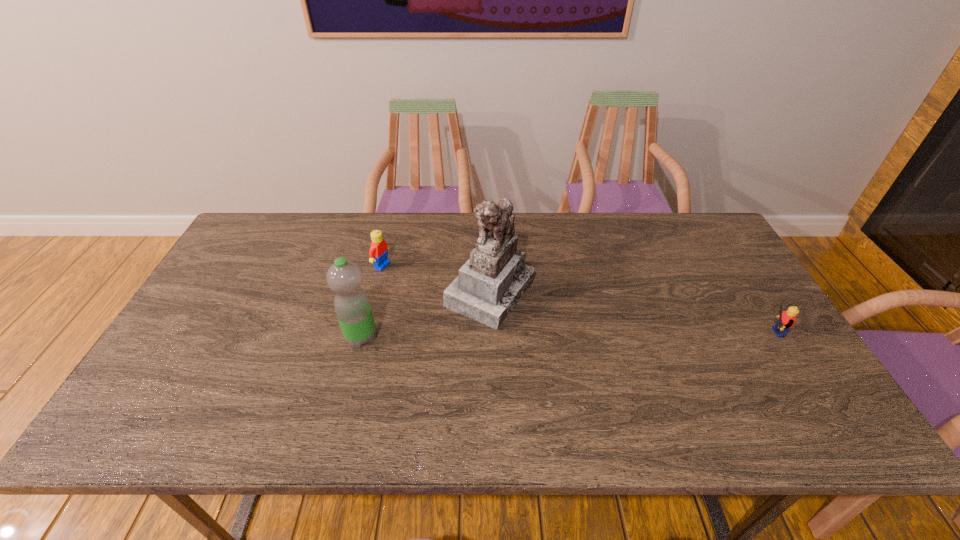
This screenshot has width=960, height=540. I want to click on water bottle, so click(x=352, y=306).

Find the location of a particular element. This screenshot has height=540, width=960. the nearer Lego is located at coordinates (786, 320).

This screenshot has height=540, width=960. Identify the location of the right Lego. (786, 320).

Find the location of a particular element. the second object from right to left is located at coordinates (489, 285).

Image resolution: width=960 pixels, height=540 pixels. Find the location of `figurine`. figurine is located at coordinates tap(489, 285).

Locate an element on the screen. The height and width of the screenshot is (540, 960). the left Lego is located at coordinates (378, 253).

Find the location of `free space located on the right of the third shortest object`. free space located on the right of the third shortest object is located at coordinates (446, 338).

This screenshot has height=540, width=960. I want to click on vacant space located 0.240m on the front-facing side of the rightmost object, so point(663,333).

Where is `vacant space situated on the front-facing side of the rightmost object`? The width and height of the screenshot is (960, 540). vacant space situated on the front-facing side of the rightmost object is located at coordinates (633, 333).

Where is `free spot located on the front-facing side of the rightmost object`? The image size is (960, 540). free spot located on the front-facing side of the rightmost object is located at coordinates (716, 333).